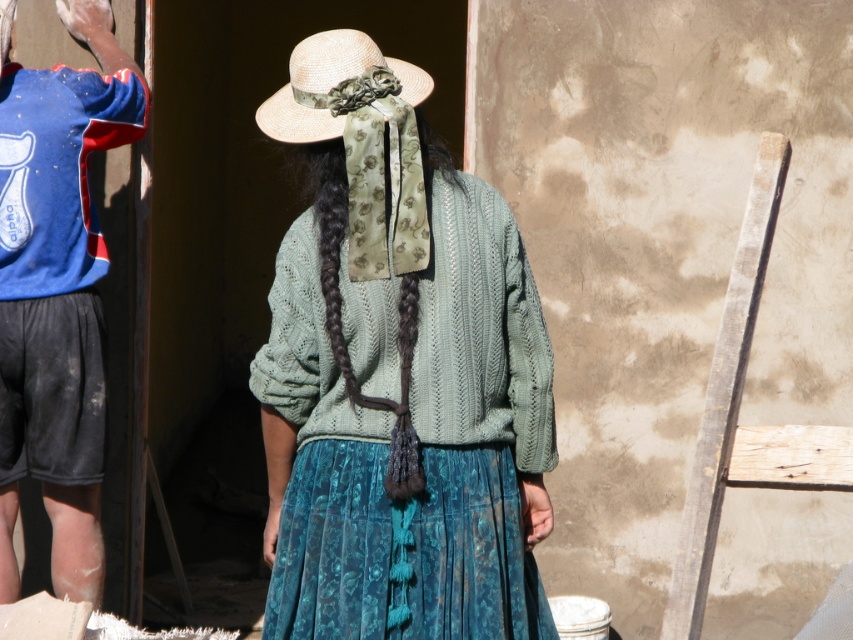
Question: Does blue fabric shirt at left come behind straw hat at center?

Choices:
 (A) no
 (B) yes

Answer: (B)

Question: Which object appears farthest from the camera in this image?

Choices:
 (A) dark brown braided hair at center
 (B) green knitted sweater at center

Answer: (A)

Question: Which object appears farthest from the camera in this image?

Choices:
 (A) dark brown braided hair at center
 (B) blue fabric shirt at left
 (C) straw hat at center
 (D) green knitted sweater at center

Answer: (B)

Question: Is green knitted sweater at center below straw hat at center?

Choices:
 (A) yes
 (B) no

Answer: (A)

Question: Can you confirm if green knitted sweater at center is wider than straw hat at center?

Choices:
 (A) yes
 (B) no

Answer: (A)

Question: Which of the following is the farthest from the observer?

Choices:
 (A) blue fabric shirt at left
 (B) dark brown braided hair at center

Answer: (A)